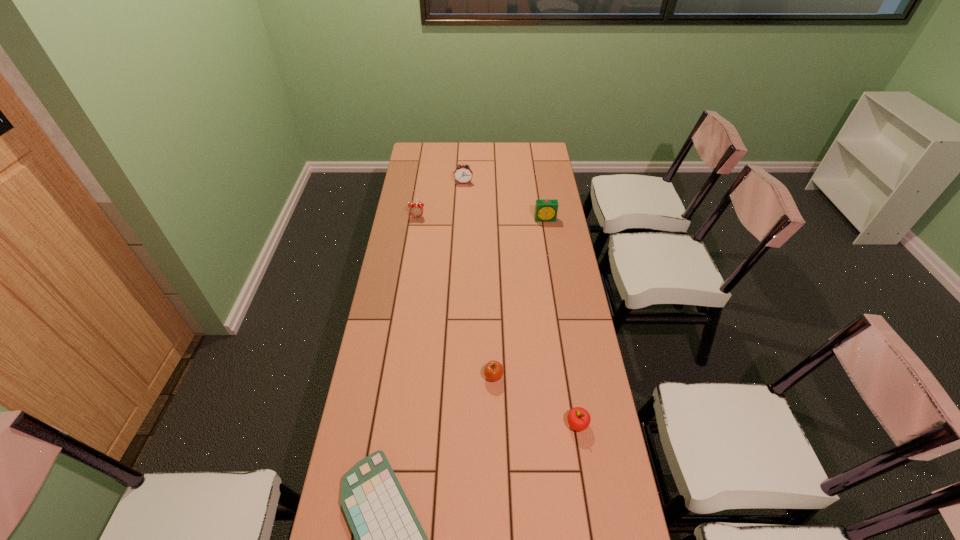
This screenshot has width=960, height=540. Find the location of `vacant space that satisfies the following two spatial constraints: 1. on the clock face of the farthest object; 2. on the left side of the farther apple`. vacant space that satisfies the following two spatial constraints: 1. on the clock face of the farthest object; 2. on the left side of the farther apple is located at coordinates (455, 376).